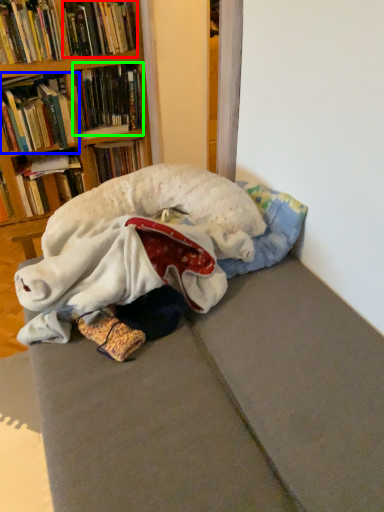
Question: Considering the real-world distances, which object is closest to book (highlighted by a red box)? book (highlighted by a blue box) or book (highlighted by a green box).

Choices:
 (A) book
 (B) book

Answer: (B)